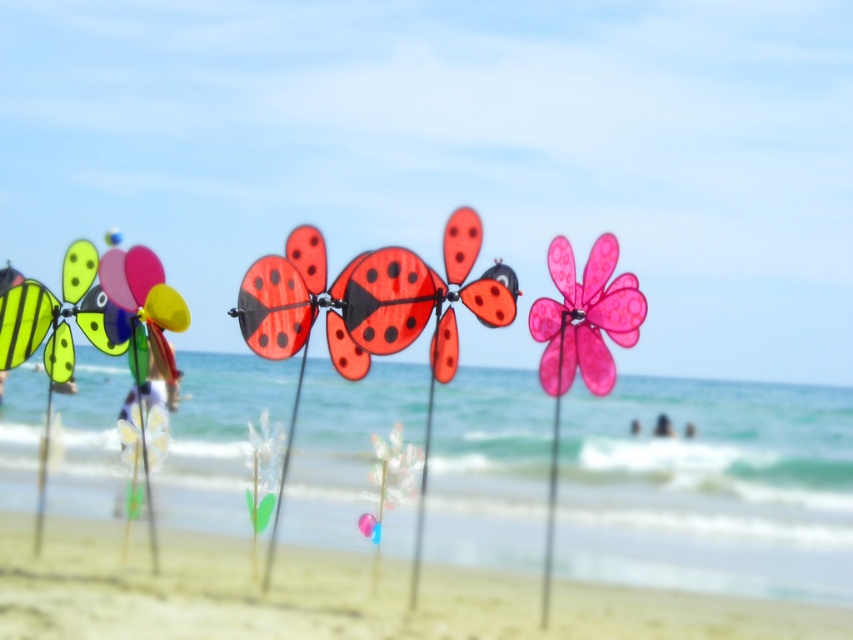
Question: Which of the following is the farthest from the observer?

Choices:
 (A) (610, 385)
 (B) (38, 326)

Answer: (B)

Question: Can you confirm if smooth sand at lower center is positioned above translucent plastic flower at center?

Choices:
 (A) no
 (B) yes

Answer: (A)

Question: Is matte plastic butterfly at center thinner than pink matte flower at center?

Choices:
 (A) yes
 (B) no

Answer: (B)

Question: Which is nearer to the pink matte flower at center?

Choices:
 (A) matte plastic butterfly at center
 (B) smooth sand at lower center
 (C) shiny red plastic butterfly at center

Answer: (A)

Question: Which of these objects is positioned closest to the pink matte flower at center?

Choices:
 (A) translucent plastic flower at center
 (B) matte plastic butterfly at center
 (C) smooth sand at lower center
 (D) yellow-green striped butterfly at left

Answer: (B)

Question: Is smooth sand at lower center thinner than matte plastic butterfly at center?

Choices:
 (A) yes
 (B) no

Answer: (B)